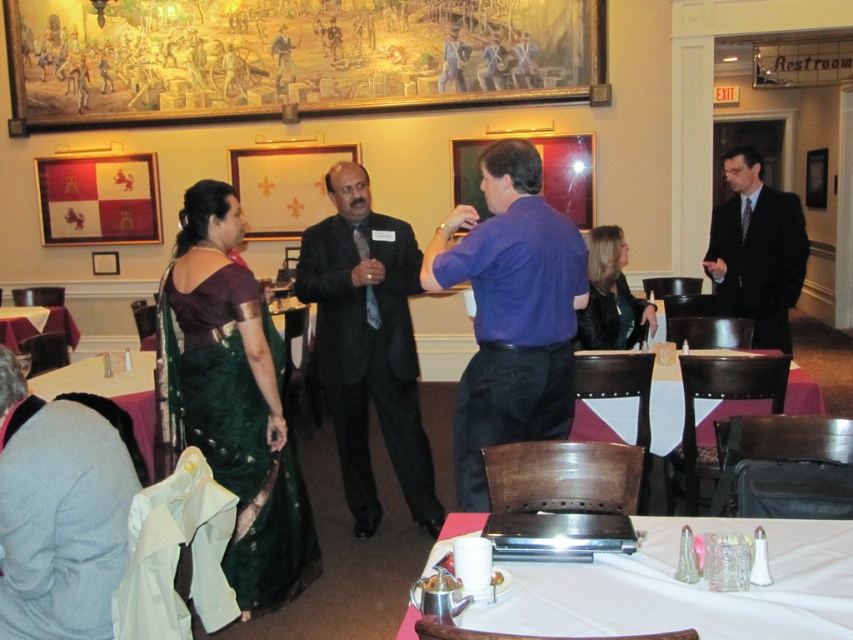
You are organizing a small event and need to place a 2m wide banner between the black suit at center and the white fabric table at lower left. Based on their widths, will the banner fit between them?

The black suit at center has a lesser width compared to white fabric table at lower left, so the banner may not fit between them if the total width of both objects exceeds the banner length. However, since the banner is 2m wide and the description only mentions their relative widths, more information is needed to determine if there is enough space.